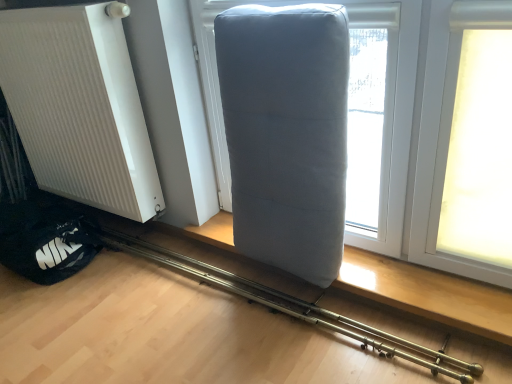
What do you see at coordinates (79, 107) in the screenshot?
I see `white ribbed radiator at left` at bounding box center [79, 107].

You are a GUI agent. You are given a task and a screenshot of the screen. Output one action in this format:
    pyautogui.click(x=<x>, y=<y>)
    Task: Click on the gray fabric pillow at center
    This screenshot has width=512, height=384.
    Given the screenshot: What is the action you would take?
    pyautogui.click(x=286, y=133)

From the picture: Can you tell me how much white ribbed radiator at left and gray fabric pillow at center differ in facing direction?

0.000229 degrees.

Image resolution: width=512 pixels, height=384 pixels. Find the location of `radiator behind the gray fabric pillow at center`. radiator behind the gray fabric pillow at center is located at coordinates (79, 107).

From a real-world perspective, is white ribbed radiator at left on gray fabric pillow at center?

Indeed, from a real-world perspective, white ribbed radiator at left stands above gray fabric pillow at center.

Would you say white ribbed radiator at left is to the left or to the right of gray fabric pillow at center in the picture?

white ribbed radiator at left is to the left of gray fabric pillow at center.

Does point (439, 370) lie behind point (309, 63)?

Yes, point (439, 370) is farther from viewer.

In terms of size, does matte gray pillow at center appear bigger or smaller than gray fabric pillow at center?

matte gray pillow at center is smaller than gray fabric pillow at center.

Can you confirm if matte gray pillow at center is thinner than gray fabric pillow at center?

In fact, matte gray pillow at center might be wider than gray fabric pillow at center.

Considering the relative sizes of white ribbed radiator at left and matte gray pillow at center in the image provided, is white ribbed radiator at left taller than matte gray pillow at center?

Indeed, white ribbed radiator at left has a greater height compared to matte gray pillow at center.

Considering their positions, is white ribbed radiator at left located in front of or behind matte gray pillow at center?

white ribbed radiator at left is positioned farther from the viewer than matte gray pillow at center.

Considering the positions of objects white ribbed radiator at left and matte gray pillow at center in the image provided, who is more to the left, white ribbed radiator at left or matte gray pillow at center?

white ribbed radiator at left is more to the left.

From the image's perspective, which is above, white ribbed radiator at left or matte gray pillow at center?

white ribbed radiator at left is shown above in the image.

Is gray fabric pillow at center at the left side of matte gray pillow at center?

No.

Which of these two, gray fabric pillow at center or matte gray pillow at center, is bigger?

gray fabric pillow at center.

In the scene shown: Who is shorter, gray fabric pillow at center or matte gray pillow at center?

With less height is matte gray pillow at center.

Is gray fabric pillow at center turned away from matte gray pillow at center?

No, gray fabric pillow at center is not facing the opposite direction of matte gray pillow at center.

Considering the relative sizes of gray fabric pillow at center and white ribbed radiator at left in the image provided, is gray fabric pillow at center shorter than white ribbed radiator at left?

Yes, gray fabric pillow at center is shorter than white ribbed radiator at left.

Is point (279, 140) positioned behind point (83, 100)?

No, it is not.

In terms of width, does gray fabric pillow at center look wider or thinner when compared to white ribbed radiator at left?

In the image, gray fabric pillow at center appears to be wider than white ribbed radiator at left.

Is matte gray pillow at center bigger than white ribbed radiator at left?

Incorrect, matte gray pillow at center is not larger than white ribbed radiator at left.

Considering the sizes of objects matte gray pillow at center and white ribbed radiator at left in the image provided, who is thinner, matte gray pillow at center or white ribbed radiator at left?

white ribbed radiator at left is thinner.

Is matte gray pillow at center next to white ribbed radiator at left?

matte gray pillow at center is not next to white ribbed radiator at left, and they're not touching.

From the picture: Is matte gray pillow at center located outside white ribbed radiator at left?

Yes, matte gray pillow at center is outside of white ribbed radiator at left.

The image size is (512, 384). In the image, there is a white ribbed radiator at left. Identify the location of furniture below it (from the image's perspective). (286, 133).

What are the coordinates of `furniture to the right of matte gray pillow at center` in the screenshot? It's located at (286, 133).

Which object lies further to the anchor point white ribbed radiator at left, matte gray pillow at center or gray fabric pillow at center?

The object further to white ribbed radiator at left is gray fabric pillow at center.

When comparing their distances from matte gray pillow at center, does gray fabric pillow at center or white ribbed radiator at left seem closer?

gray fabric pillow at center is closer to matte gray pillow at center.

Considering their positions, is gray fabric pillow at center positioned further to white ribbed radiator at left than matte gray pillow at center?

gray fabric pillow at center is further to white ribbed radiator at left.

Based on their spatial positions, is white ribbed radiator at left or gray fabric pillow at center closer to matte gray pillow at center?

The object closer to matte gray pillow at center is gray fabric pillow at center.

Based on the photo, based on their spatial positions, is matte gray pillow at center or white ribbed radiator at left further from gray fabric pillow at center?

Among the two, white ribbed radiator at left is located further to gray fabric pillow at center.

When comparing their distances from gray fabric pillow at center, does white ribbed radiator at left or matte gray pillow at center seem closer?

matte gray pillow at center is closer to gray fabric pillow at center.

Identify the location of equipment between white ribbed radiator at left and gray fabric pillow at center from left to right. This screenshot has height=384, width=512. (296, 307).